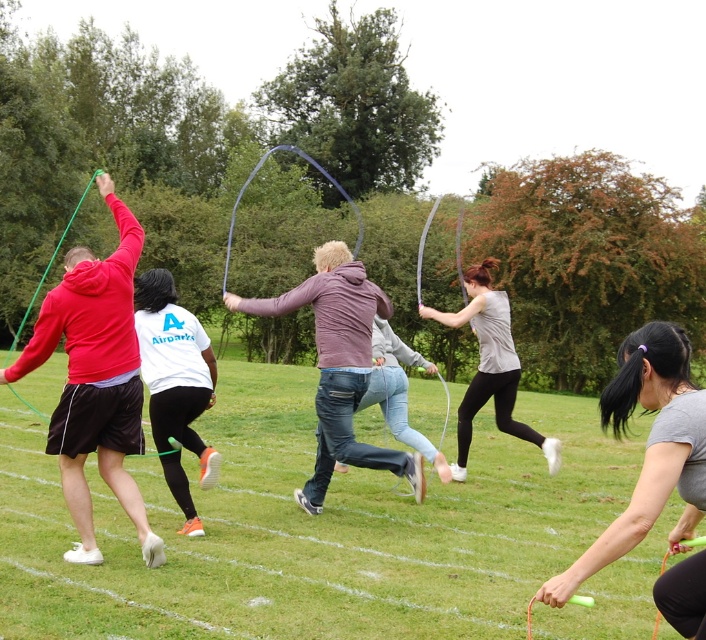
Question: Which of these objects is positioned farthest from the green rubber jump rope at center?

Choices:
 (A) matte gray tank top at center
 (B) white matte t-shirt at center
 (C) matte gray hoodie at center
 (D) matte red hoodie at left

Answer: (D)

Question: Does green rubber jump rope at center lie behind white matte t-shirt at center?

Choices:
 (A) yes
 (B) no

Answer: (B)

Question: Where is green rubber jump rope at center located in relation to matte gray hoodie at center in the image?

Choices:
 (A) above
 (B) below

Answer: (B)

Question: Estimate the real-world distances between objects in this image. Which object is closer to the matte gray tank top at center?

Choices:
 (A) matte gray hoodie at center
 (B) gray matte jump rope at lower right
 (C) green rubber jump rope at center
 (D) white matte t-shirt at center

Answer: (A)

Question: Can you confirm if matte red hoodie at left is positioned to the left of white matte t-shirt at center?

Choices:
 (A) no
 (B) yes

Answer: (B)

Question: Which point appears farthest from the camera in this image?

Choices:
 (A) (76, 248)
 (B) (469, 269)

Answer: (B)